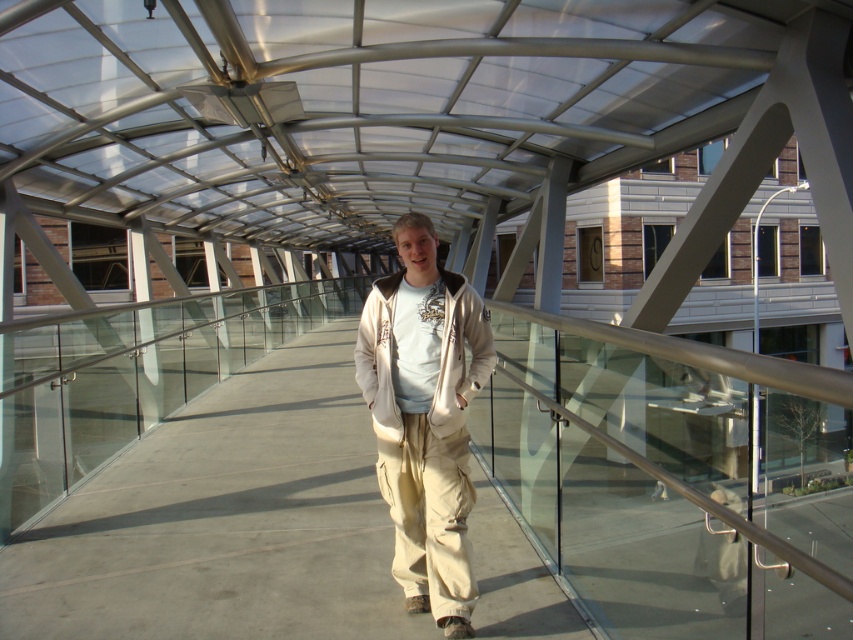
Is beige cotton pants at center shorter than beige fleece sweatshirt at center?

In fact, beige cotton pants at center may be taller than beige fleece sweatshirt at center.

Can you confirm if beige cotton pants at center is positioned to the right of beige fleece sweatshirt at center?

Incorrect, beige cotton pants at center is not on the right side of beige fleece sweatshirt at center.

Where is `beige cotton pants at center`? beige cotton pants at center is located at coordinates (425, 419).

Which is more to the right, beige fabric pants at center or beige cotton pants at center?

beige cotton pants at center is more to the right.

Is beige fabric pants at center taller than beige cotton pants at center?

In fact, beige fabric pants at center may be shorter than beige cotton pants at center.

Is point (192, 632) positioned before point (425, 605)?

That is True.

Where is `beige fabric pants at center`? This screenshot has height=640, width=853. beige fabric pants at center is located at coordinates (225, 520).

Is beige fabric pants at center positioned in front of beige fleece sweatshirt at center?

No, it is behind beige fleece sweatshirt at center.

Between beige fabric pants at center and beige fleece sweatshirt at center, which one is positioned lower?

Positioned lower is beige fabric pants at center.

Between point (119, 508) and point (468, 296), which one is positioned in front?

Point (468, 296) is in front.

Where is `beige fabric pants at center`? The image size is (853, 640). beige fabric pants at center is located at coordinates (225, 520).